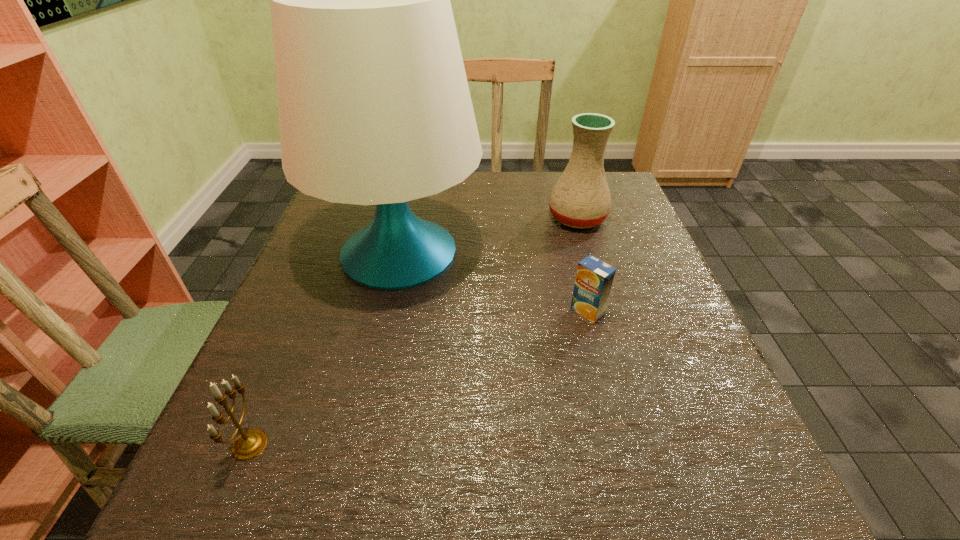
The width and height of the screenshot is (960, 540). Identify the location of table lamp. (374, 107).

At what (x,y) coordinates should I click in order to perform the action: click on pottery. Please return your answer as a coordinate pair (x, y). Looking at the image, I should click on tap(581, 198).

Identify the location of candelabrum. Image resolution: width=960 pixels, height=540 pixels. (249, 444).

The image size is (960, 540). Find the location of `the nearest object`. the nearest object is located at coordinates (249, 444).

This screenshot has width=960, height=540. I want to click on the shortest object, so click(x=594, y=278).

Locate an element on the screen. blank space located on the front-facing side of the table lamp is located at coordinates (525, 251).

Where is `vacant space located 0.120m on the back of the pottery`? vacant space located 0.120m on the back of the pottery is located at coordinates (566, 180).

Image resolution: width=960 pixels, height=540 pixels. I want to click on vacant space located 0.300m on the right of the nearest object, so click(x=467, y=445).

Locate an element on the screen. vacant space located 0.070m on the back of the orange_juice is located at coordinates (579, 277).

Identify the location of table lamp that is positioned at the far edge. (374, 107).